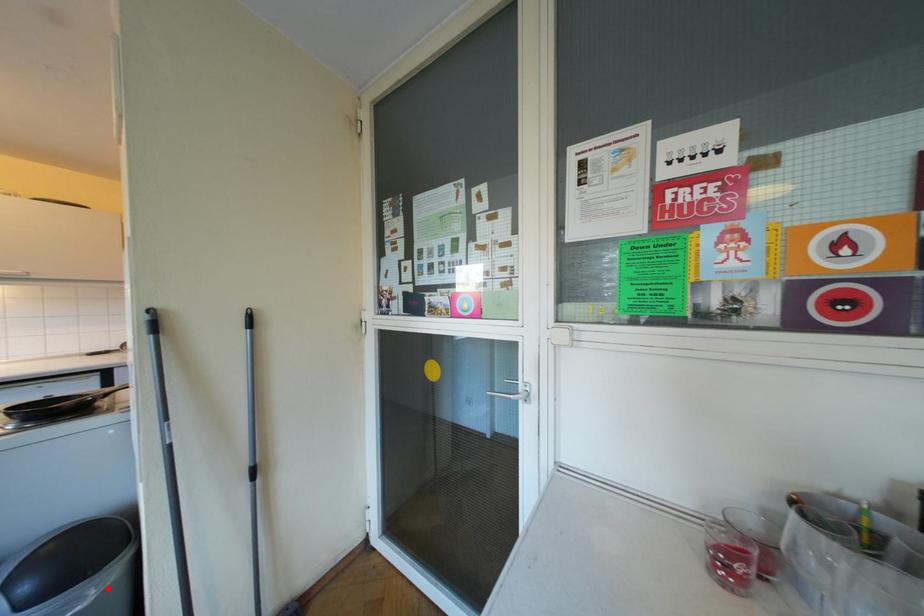
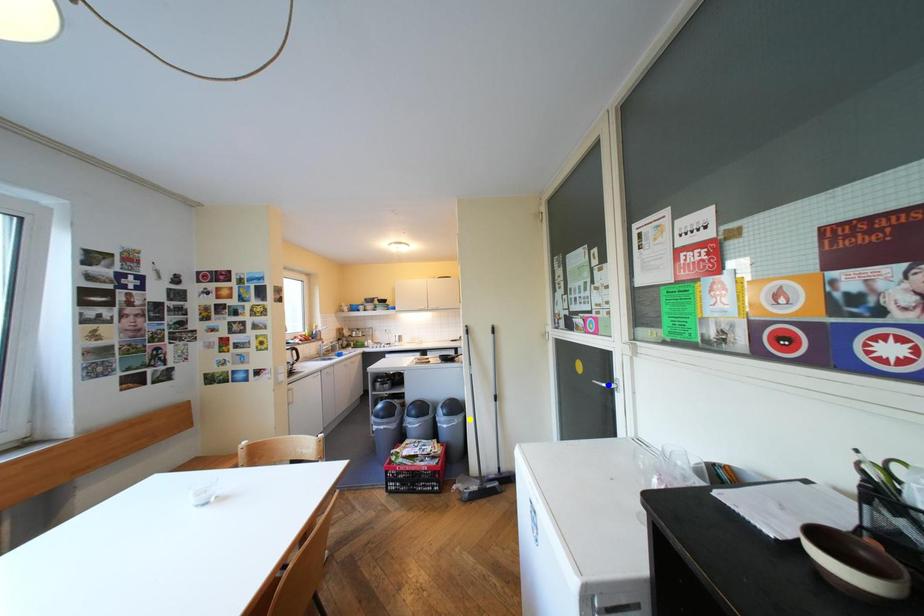
Question: I am providing you with two images of the same scene from different viewpoints. A red point is marked on the first image. You are given multiple points on the second image. Which mark in image 2 goes with the point in image 1?

Choices:
 (A) green point
 (B) yellow point
 (C) blue point

Answer: (B)